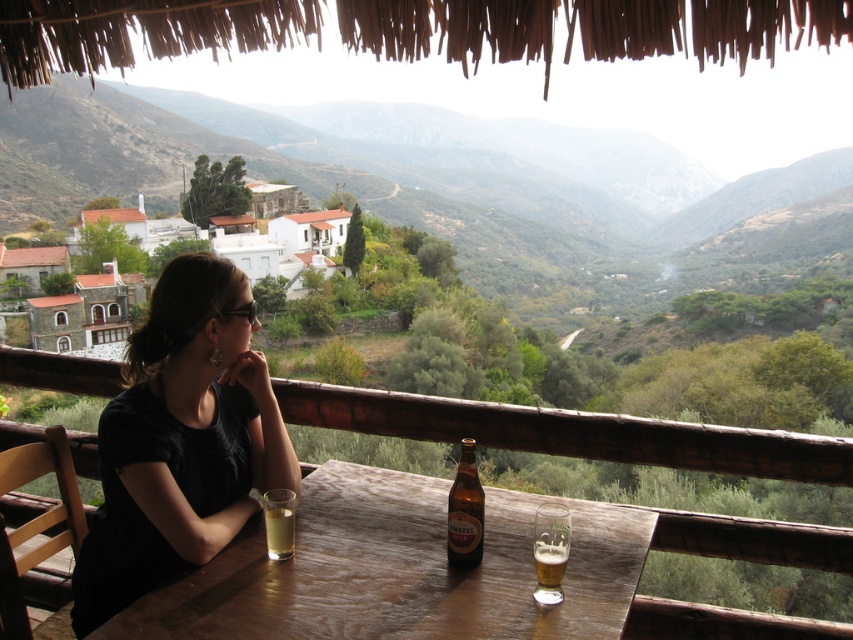
You are a photographer trying to capture the woman sitting at the table. You want to ensure the translucent glass at table left is visible in the shot without being blocked by the black matte shirt at center. Is this possible given their positions?

The translucent glass at table left is behind the black matte shirt at center, so it might be partially or fully obscured depending on the angle. Adjust your position to ensure the glass is not blocked by the shirt.

You are a photographer setting up a shot of the black matte shirt at center and the translucent glass at table left. Which object should you focus on first if you want to highlight the larger item in your composition?

The black matte shirt at center is larger in size than the translucent glass at table left, so you should focus on the black matte shirt at center first to highlight the larger item in your composition.